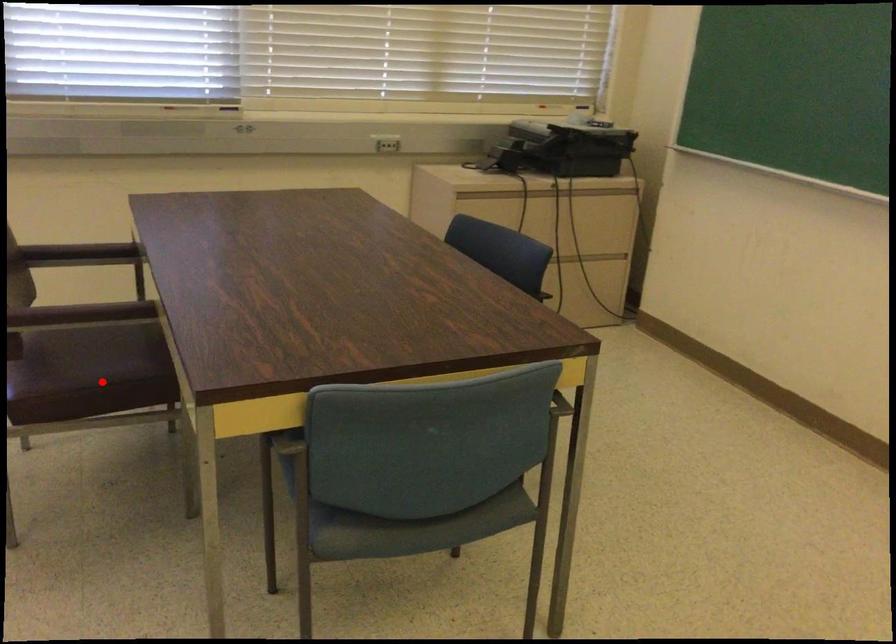
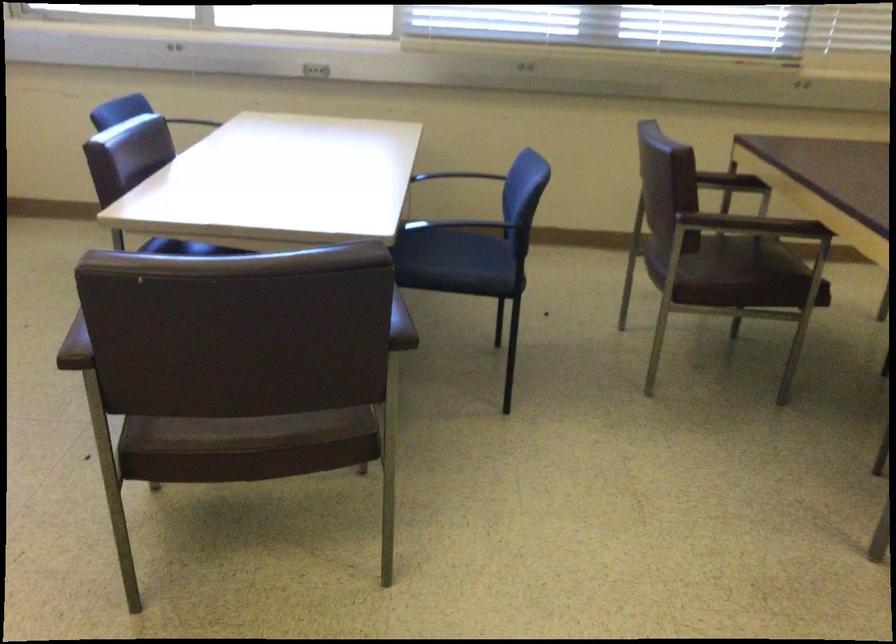
Question: I am providing you with two images of the same scene from different viewpoints. A red point is shown in image1. For the corresponding object point in image2, is it positioned nearer or farther from the camera?

Choices:
 (A) Nearer
 (B) Farther

Answer: (B)